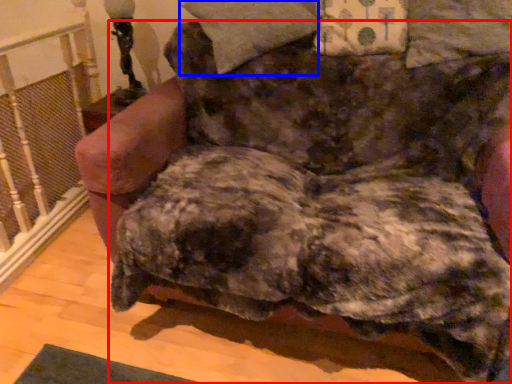
Question: Which object is further to the camera taking this photo, dog (highlighted by a red box) or pillow (highlighted by a blue box)?

Choices:
 (A) dog
 (B) pillow

Answer: (B)